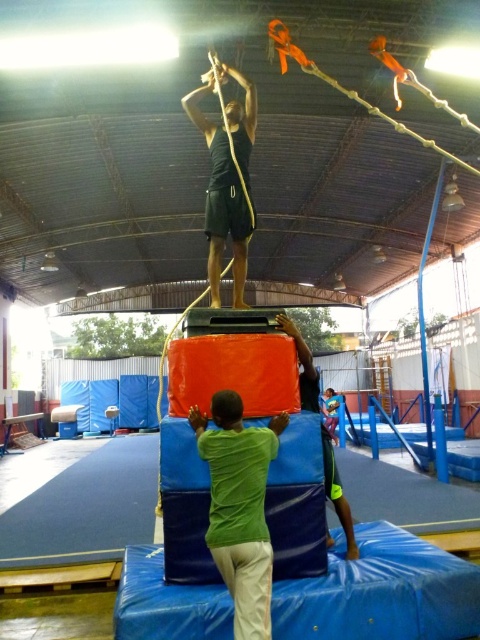
You are standing in the gymnasium and want to reach the point marked at coordinates point (239, 592). If your reach extends 3 feet in front of you, will you be able to touch that point without moving closer?

The distance between you and point (239, 592) is 8.10 feet, which is farther than your 3 feet reach. Therefore, you cannot touch it without moving closer.

You are an observer in the gymnasium and want to know the position of the two people. Which object is on the left side when looking at the green matte shirt at center and the green fabric person at center?

The green matte shirt at center is positioned to the left of the green fabric person at center.

You are a photographer positioned at the camera. You notice two points in the image labeled as point (240, 609) and point (231, 106). Which point is nearer to your current position?

Point (240, 609) is closer to the camera than point (231, 106). Therefore, point (240, 609) is nearer to your current position.